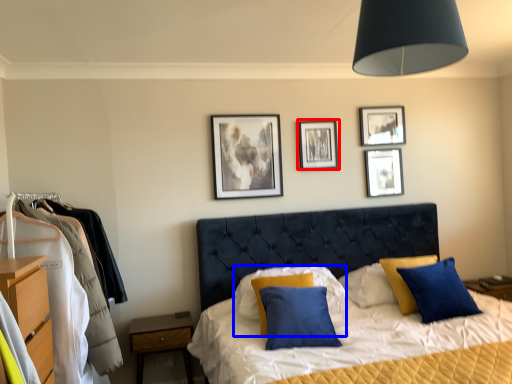
Question: Which object appears closest to the camera in this image, picture frame (highlighted by a red box) or pillow (highlighted by a blue box)?

Choices:
 (A) picture frame
 (B) pillow

Answer: (B)